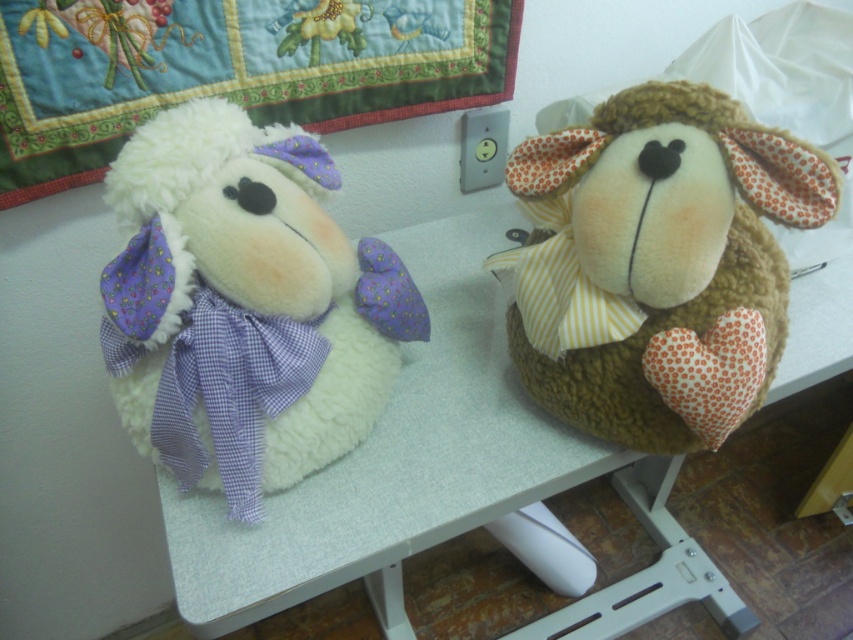
Question: Which object appears closest to the camera in this image?

Choices:
 (A) embroidered cotton quilt at upper left
 (B) white fluffy sheep at left
 (C) white textured table at center

Answer: (B)

Question: Is white textured table at center wider than embroidered cotton quilt at upper left?

Choices:
 (A) no
 (B) yes

Answer: (B)

Question: Can you confirm if white textured table at center is positioned below brown fuzzy stuffed animal at right?

Choices:
 (A) no
 (B) yes

Answer: (B)

Question: Among these objects, which one is farthest from the camera?

Choices:
 (A) white textured table at center
 (B) white fluffy sheep at left

Answer: (A)

Question: Can you confirm if brown fuzzy stuffed animal at right is bigger than embroidered cotton quilt at upper left?

Choices:
 (A) no
 (B) yes

Answer: (A)

Question: Which point is farther from the camera taking this photo?

Choices:
 (A) (198, 248)
 (B) (413, 444)
 (C) (671, 88)
 (D) (131, 35)

Answer: (D)